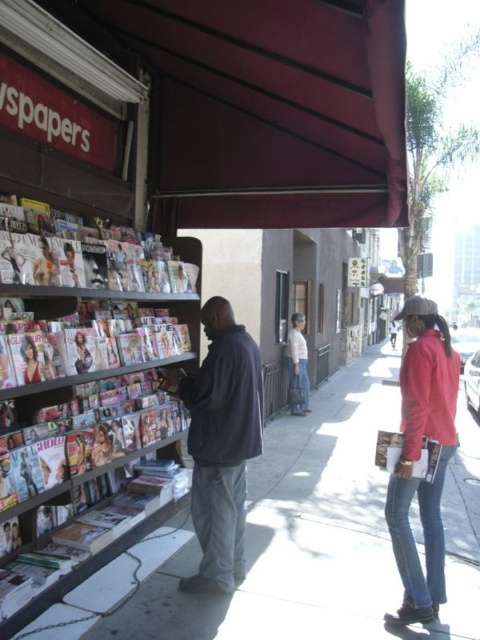
Question: Is dark gray jacket at center closer to the viewer compared to light beige pants at center?

Choices:
 (A) no
 (B) yes

Answer: (B)

Question: Is the position of smooth concrete sidewalk at lower left more distant than that of dark gray jacket at center?

Choices:
 (A) no
 (B) yes

Answer: (A)

Question: Which point is farther from the camera taking this photo?

Choices:
 (A) (145, 605)
 (B) (304, 356)
 (C) (44, 556)
 (D) (410, 419)

Answer: (B)

Question: Where is red leather jacket at right located in relation to light beige pants at center in the image?

Choices:
 (A) above
 (B) below

Answer: (A)

Question: Considering the real-world distances, which object is closest to the dark gray jacket at center?

Choices:
 (A) metallic glossy magazines at left
 (B) smooth concrete sidewalk at lower left

Answer: (A)

Question: Which object is the farthest from the light beige pants at center?

Choices:
 (A) smooth concrete sidewalk at lower left
 (B) metallic glossy magazines at left
 (C) red leather jacket at right
 (D) dark gray jacket at center

Answer: (D)